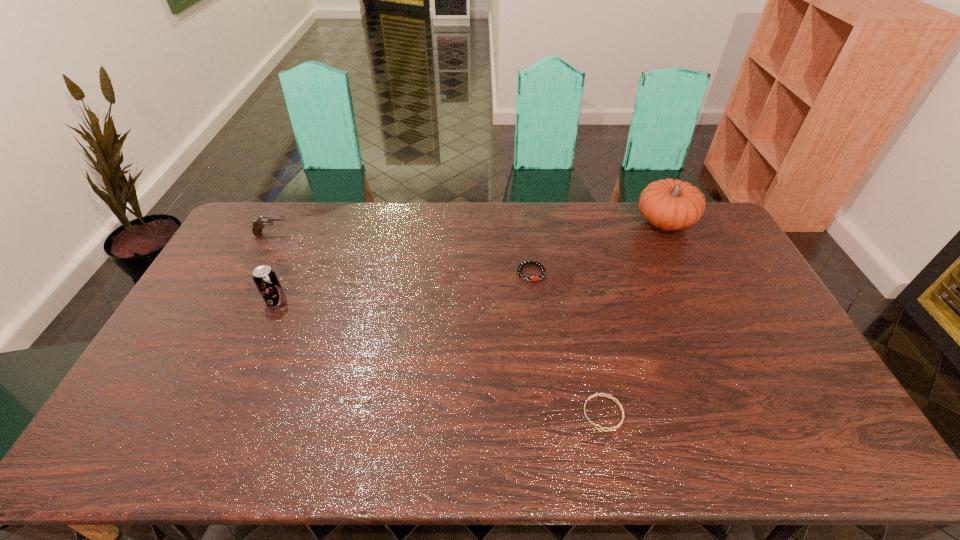
Locate an element on the screen. The image size is (960, 540). object located at the right edge is located at coordinates (669, 204).

Where is `object situated at the far left corner`? object situated at the far left corner is located at coordinates (259, 224).

You are a GUI agent. You are given a task and a screenshot of the screen. Output one action in this format:
    pyautogui.click(x=<x>, y=<y>)
    Task: Click on the object that is at the far right corner
    
    Given the screenshot: What is the action you would take?
    pyautogui.click(x=669, y=204)

In order to click on vacant point at the far edge in this screenshot , I will do `click(563, 213)`.

Locate an element on the screen. blank space at the near edge of the desktop is located at coordinates (717, 431).

In the image, there is a desktop. Where is `vacant space at the left edge`? vacant space at the left edge is located at coordinates (234, 262).

In the image, there is a desktop. At what (x,y) coordinates should I click in order to perform the action: click on vacant space at the right edge. Please return your answer as a coordinate pair (x, y). This screenshot has width=960, height=540. Looking at the image, I should click on (718, 265).

The height and width of the screenshot is (540, 960). Identify the location of vacant point located between the farther bracelet and the right bracelet. (x=567, y=343).

This screenshot has width=960, height=540. I want to click on empty location between the nearer bracelet and the third shortest object, so click(438, 323).

Locate an element on the screen. The width and height of the screenshot is (960, 540). blank region between the soda can and the third object from right to left is located at coordinates (403, 287).